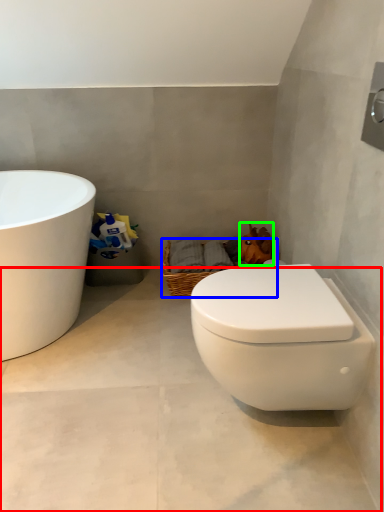
Question: Which object is positioned farthest from concrete (highlighted by a red box)? Select from basket (highlighted by a blue box) and animal (highlighted by a green box).

Choices:
 (A) basket
 (B) animal

Answer: (B)